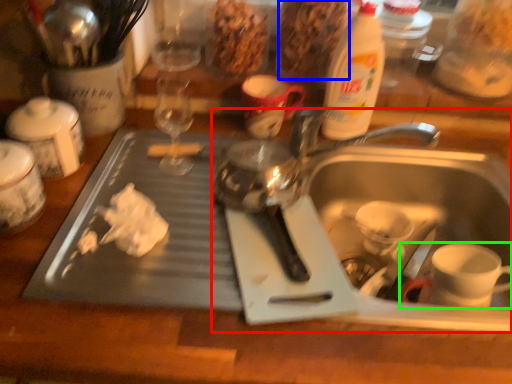
Question: Which object is positioned closest to sink (highlighted by a red box)? Select from food (highlighted by a blue box) and coffee cup (highlighted by a green box).

Choices:
 (A) food
 (B) coffee cup

Answer: (B)